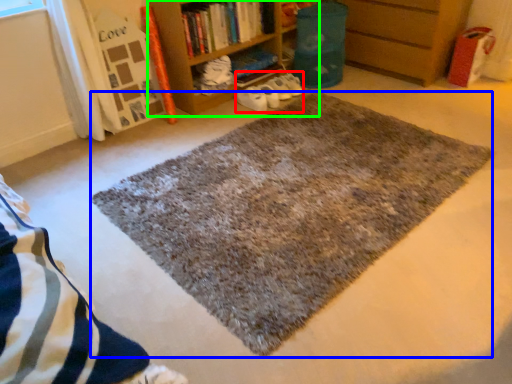
Question: Which object is the closest to the shoe (highlighted by a red box)? Choose among these: mat (highlighted by a blue box) or bookcase (highlighted by a green box).

Choices:
 (A) mat
 (B) bookcase

Answer: (B)